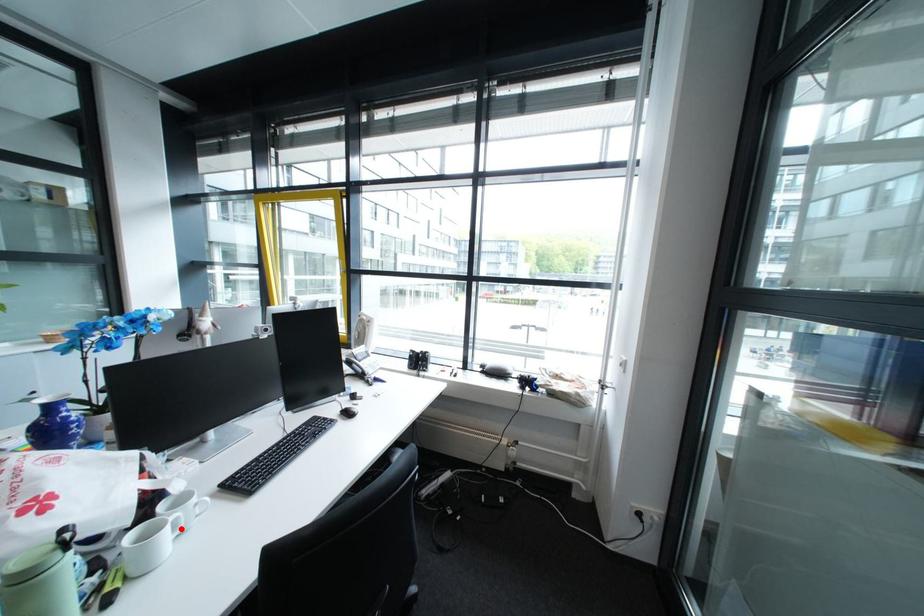
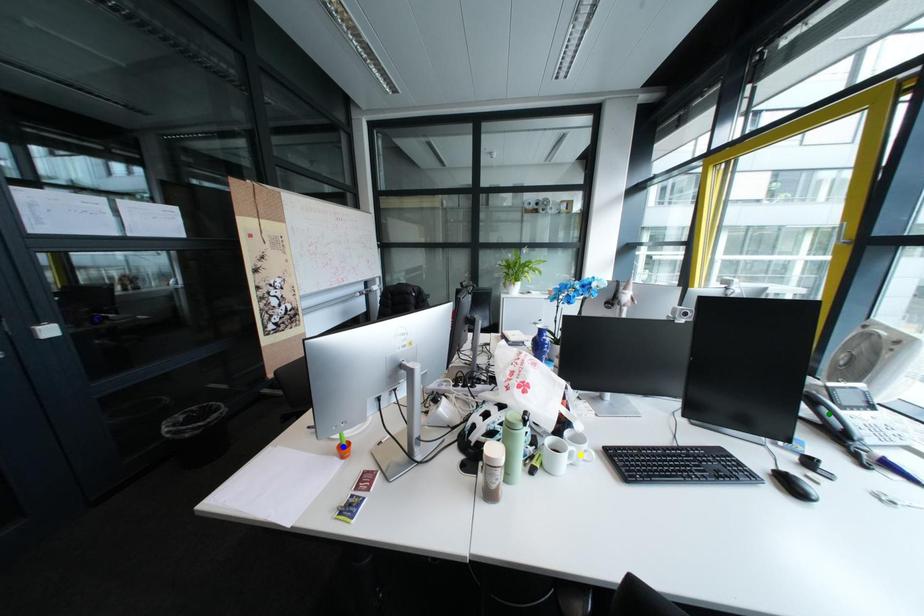
Question: I am providing you with two images of the same scene from different viewpoints. A red point is marked on the first image. You are given multiple points on the second image. Which mark in image 2 goes with the point in image 1?

Choices:
 (A) blue point
 (B) yellow point
 (C) green point

Answer: (B)